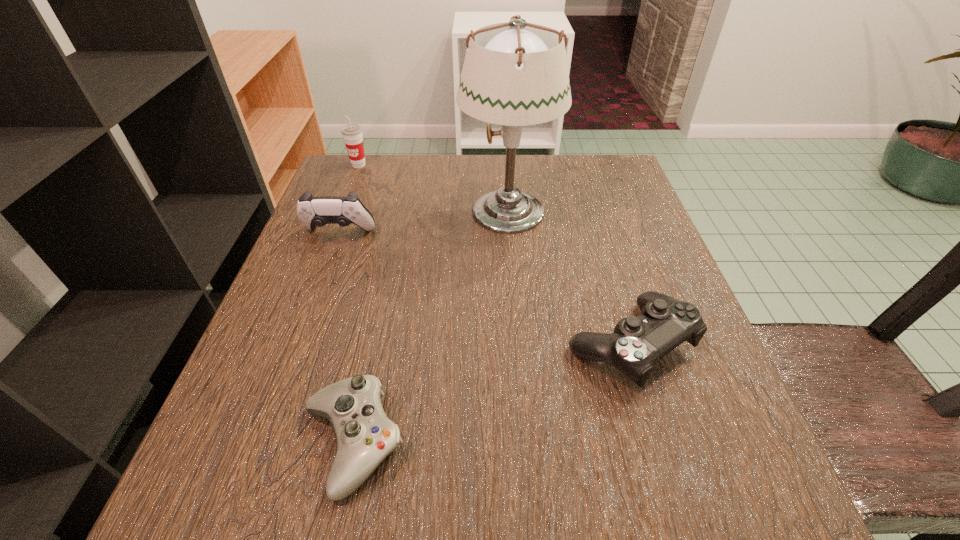
Identify the location of free space at the far edge. The image size is (960, 540). (446, 198).

Identify the location of vacant area at the near edge. click(x=540, y=534).

Where is `vacant space at the left edge of the desktop`? The image size is (960, 540). vacant space at the left edge of the desktop is located at coordinates (242, 381).

The width and height of the screenshot is (960, 540). I want to click on free region at the right edge of the desktop, so click(729, 443).

The width and height of the screenshot is (960, 540). Identify the location of free space at the far left corner. (340, 167).

At what (x,y) coordinates should I click in order to perform the action: click on vacant region at the far right corner of the desktop. Please return your answer as a coordinate pair (x, y). The image size is (960, 540). Looking at the image, I should click on (636, 197).

Where is `free space between the shortest control and the lampshade`? Image resolution: width=960 pixels, height=540 pixels. free space between the shortest control and the lampshade is located at coordinates (430, 327).

Find the location of a particular element. This screenshot has height=540, width=960. empty location between the cup and the lampshade is located at coordinates (433, 187).

This screenshot has width=960, height=540. I want to click on empty space that is in between the rightmost control and the farthest control, so click(484, 289).

Locate an element on the screen. empty space between the farthest control and the rightmost control is located at coordinates (484, 289).